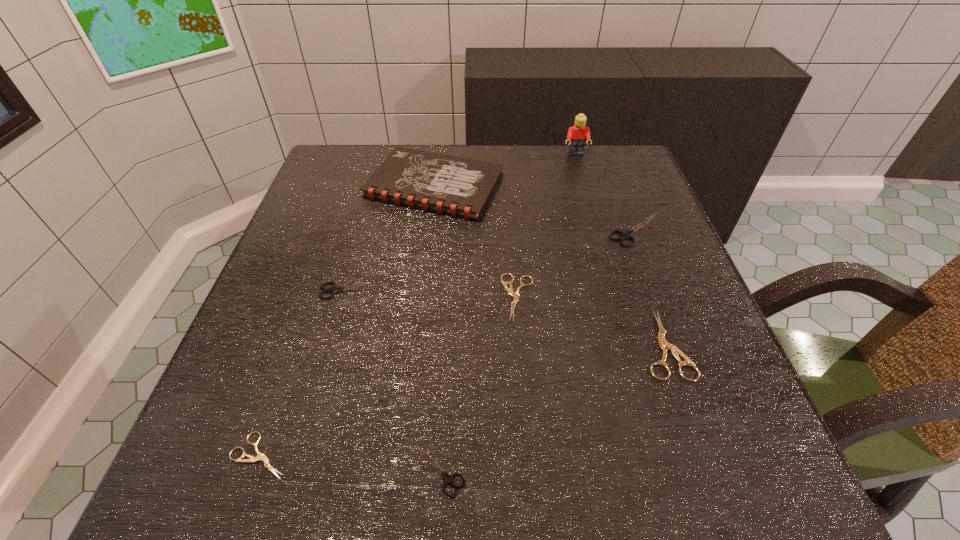
What are the coordinates of `Lego` in the screenshot? It's located at (577, 135).

You are a GUI agent. You are given a task and a screenshot of the screen. Output one action in this format:
    pyautogui.click(x=<x>, y=<y>)
    Task: Click on the second tallest object
    This screenshot has width=960, height=540.
    Given the screenshot: What is the action you would take?
    pyautogui.click(x=456, y=186)

You are a GUI agent. You are given a task and a screenshot of the screen. Output one action in this format:
    pyautogui.click(x=<x>, y=<y>)
    Task: Click on the biggest black shears
    This screenshot has height=540, width=960.
    Given the screenshot: What is the action you would take?
    pyautogui.click(x=625, y=235)

The image size is (960, 540). In order to click on the rightmost black shears in this screenshot , I will do `click(625, 235)`.

This screenshot has height=540, width=960. What are the coordinates of `the leftmost black shears` in the screenshot? It's located at (335, 289).

I want to click on the second farthest black shears, so click(x=335, y=289).

Where is `the rightmost beige shears`? Image resolution: width=960 pixels, height=540 pixels. the rightmost beige shears is located at coordinates (663, 344).

I want to click on the second beige shears from left to right, so click(515, 295).

The height and width of the screenshot is (540, 960). I want to click on the second smallest beige shears, so click(515, 295).

At what (x,y) coordinates should I click in order to perform the action: click on the nearest black shears. Please return your answer as a coordinate pair (x, y). This screenshot has height=540, width=960. Looking at the image, I should click on (449, 479).